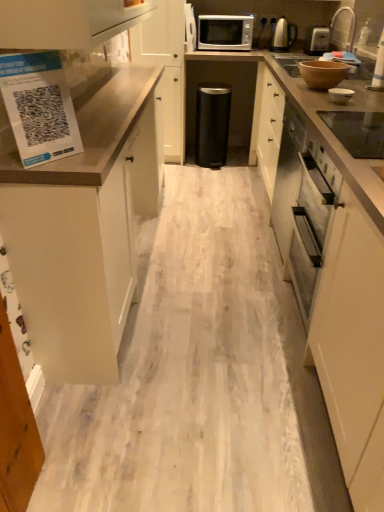
Where is `vacant region to the right of white matte cabinet at left, the 2th cabinetry when ordered from back to front`? This screenshot has height=512, width=384. vacant region to the right of white matte cabinet at left, the 2th cabinetry when ordered from back to front is located at coordinates (212, 251).